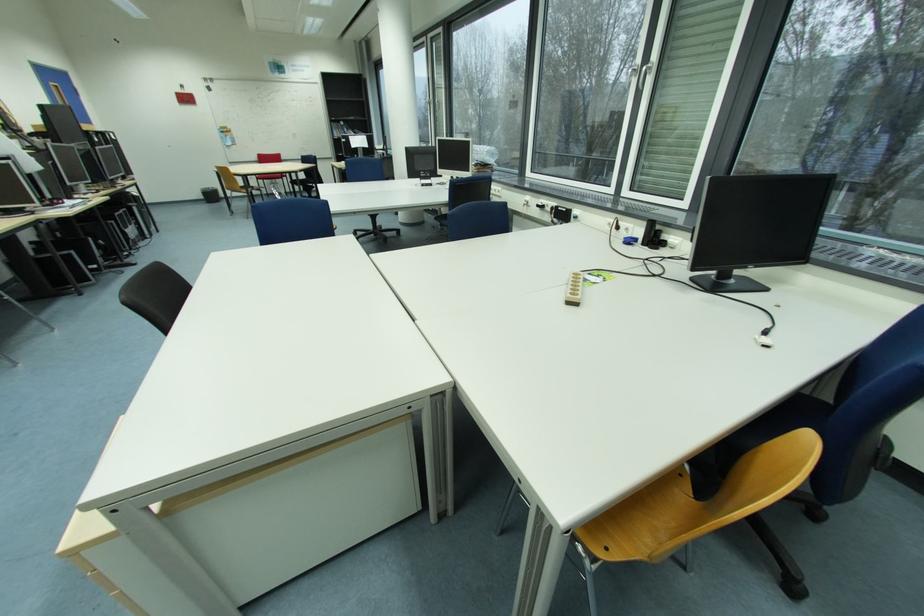
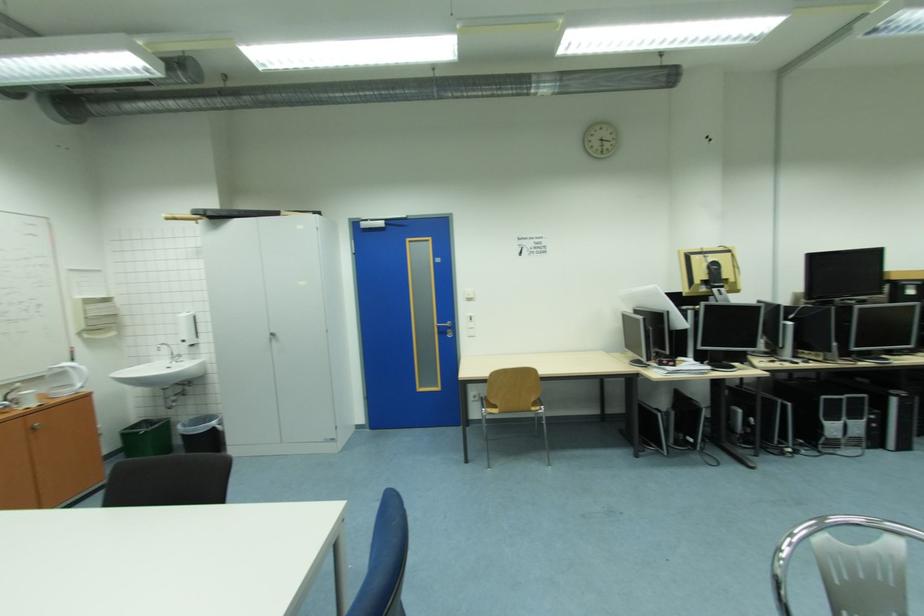
In the second image, find the point that corresponds to pixel 78 254 in the first image.

(663, 416)